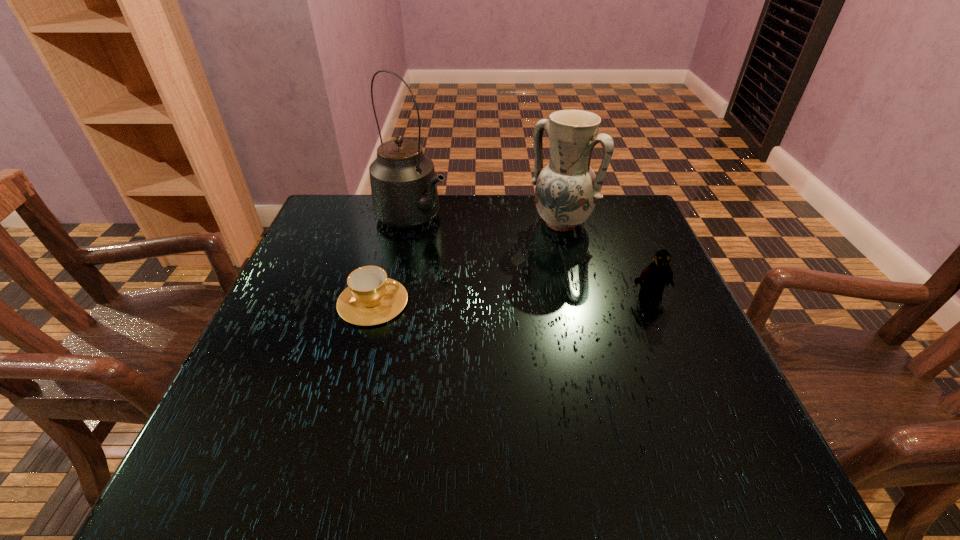
The width and height of the screenshot is (960, 540). Find the location of `object situated at the far left corner`. object situated at the far left corner is located at coordinates (404, 191).

Find the location of `object positioned at the far right corner`. object positioned at the far right corner is located at coordinates (567, 189).

The height and width of the screenshot is (540, 960). In the image, there is a desktop. Identify the location of vacant area at the far edge. (393, 242).

You are a GUI agent. You are given a task and a screenshot of the screen. Output one action in this format:
    pyautogui.click(x=<x>, y=<y>)
    Task: Click on the vacant space at the near edge of the desktop
    This screenshot has width=960, height=540.
    Given the screenshot: What is the action you would take?
    pyautogui.click(x=492, y=392)

Find the location of a particular element. The image size is (960, 540). free region at the left edge of the desktop is located at coordinates (255, 352).

Locate an element on the screen. The width and height of the screenshot is (960, 540). free space at the right edge of the desktop is located at coordinates (705, 355).

Locate an element on the screen. This screenshot has height=540, width=960. free space at the far left corner is located at coordinates (317, 225).

Locate an element on the screen. free point at the near left corner is located at coordinates (252, 407).

I want to click on vacant area at the far right corner of the desktop, so click(617, 222).

Where is `unoccupied position between the kettle and the third object from left to right`? This screenshot has height=540, width=960. unoccupied position between the kettle and the third object from left to right is located at coordinates (487, 220).